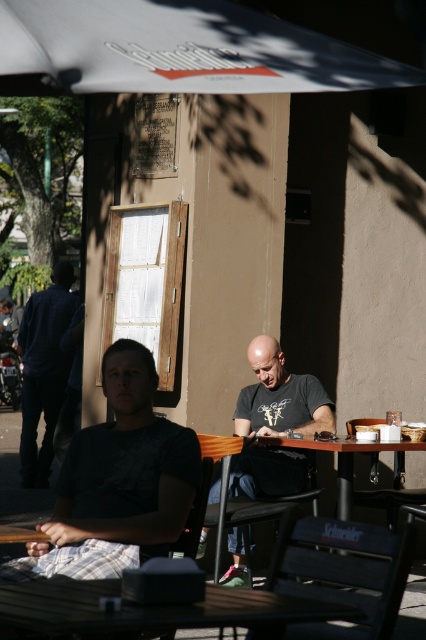
Question: Which object appears farthest from the camera in this image?

Choices:
 (A) dark blue sweater at left
 (B) wooden picnic table at center

Answer: (A)

Question: Which object is farther from the camera taking this photo?

Choices:
 (A) dark gray t-shirt at center
 (B) wooden table at center
 (C) white fabric canopy at upper center

Answer: (A)

Question: Observing the image, what is the correct spatial positioning of white fabric canopy at upper center in reference to wooden table at center?

Choices:
 (A) below
 (B) above

Answer: (B)

Question: Estimate the real-world distances between objects in this image. Which object is farther from the black matte shirt at center?

Choices:
 (A) dark blue sweater at left
 (B) wooden table at center
 (C) wooden picnic table at center

Answer: (A)

Question: Can you confirm if white fabric canopy at upper center is positioned below wooden picnic table at center?

Choices:
 (A) no
 (B) yes

Answer: (A)

Question: Can you confirm if black matte shirt at center is positioned to the left of dark blue sweater at left?

Choices:
 (A) no
 (B) yes

Answer: (A)